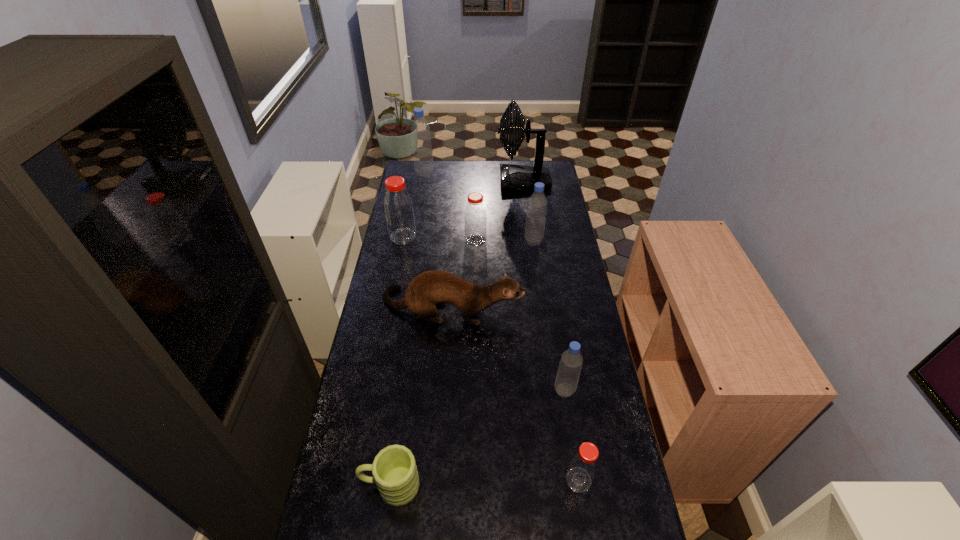
Identify the location of fan. (513, 178).

I want to click on the eighth shortest object, so click(420, 130).

This screenshot has width=960, height=540. Find the location of `the leftmost blue bottle`. the leftmost blue bottle is located at coordinates (420, 130).

At what (x,y) coordinates should I click in order to perform the action: click on the leftmost red bottle. Please return your answer as a coordinate pair (x, y). Looking at the image, I should click on (398, 207).

The image size is (960, 540). I want to click on the second biggest blue bottle, so tap(537, 204).

You are a GUI agent. You are given a task and a screenshot of the screen. Output one action in this format:
    pyautogui.click(x=<x>, y=<y>)
    Task: Click on the fourth bottle from right to left
    The width and height of the screenshot is (960, 540).
    Given the screenshot: What is the action you would take?
    pyautogui.click(x=475, y=218)

This screenshot has width=960, height=540. In order to click on the second red bottle from left to right in this screenshot , I will do `click(475, 218)`.

What are the coordinates of `the third nearest object` in the screenshot? It's located at (571, 361).

At what (x,y) coordinates should I click in order to perform the action: click on the smallest blue bottle. Please return your answer as a coordinate pair (x, y). Image resolution: width=960 pixels, height=540 pixels. Looking at the image, I should click on (571, 361).

I want to click on ferret, so tap(435, 287).